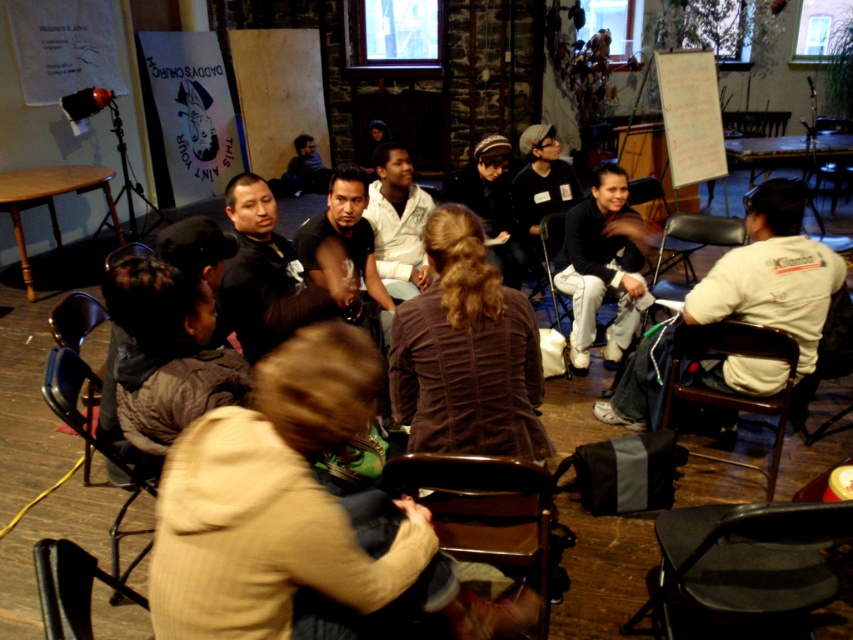
Between white fabric chair at center and dark gray knit hat at center, which one is positioned higher?

dark gray knit hat at center

You are a GUI agent. You are given a task and a screenshot of the screen. Output one action in this format:
    pyautogui.click(x=<x>, y=<y>)
    Task: Click on the white fabric chair at center
    Image resolution: width=853 pixels, height=640 pixels.
    Given the screenshot: What is the action you would take?
    pyautogui.click(x=599, y=280)

The height and width of the screenshot is (640, 853). What do you see at coordinates (750, 556) in the screenshot? I see `black fabric chair at lower right` at bounding box center [750, 556].

Locate an element on the screen. black fabric chair at lower right is located at coordinates (750, 556).

Describe the element at coordinates (599, 280) in the screenshot. I see `white fabric chair at center` at that location.

Is white fabric chair at center bigger than wooden chair at right?

Incorrect, white fabric chair at center is not larger than wooden chair at right.

Which is behind, point (596, 234) or point (724, 336)?

The point (596, 234) is more distant.

Find the location of a particular element. The width and height of the screenshot is (853, 640). white fabric chair at center is located at coordinates (599, 280).